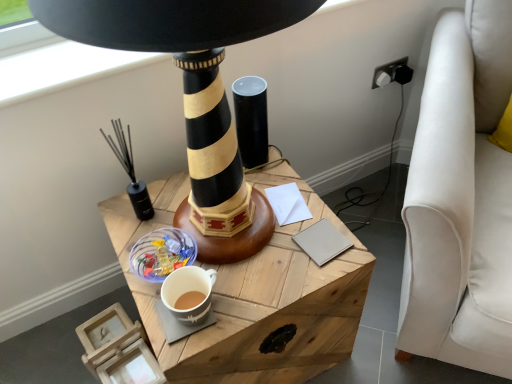
Where is `free point behind matte ceramic mug at lower center`? free point behind matte ceramic mug at lower center is located at coordinates (218, 251).